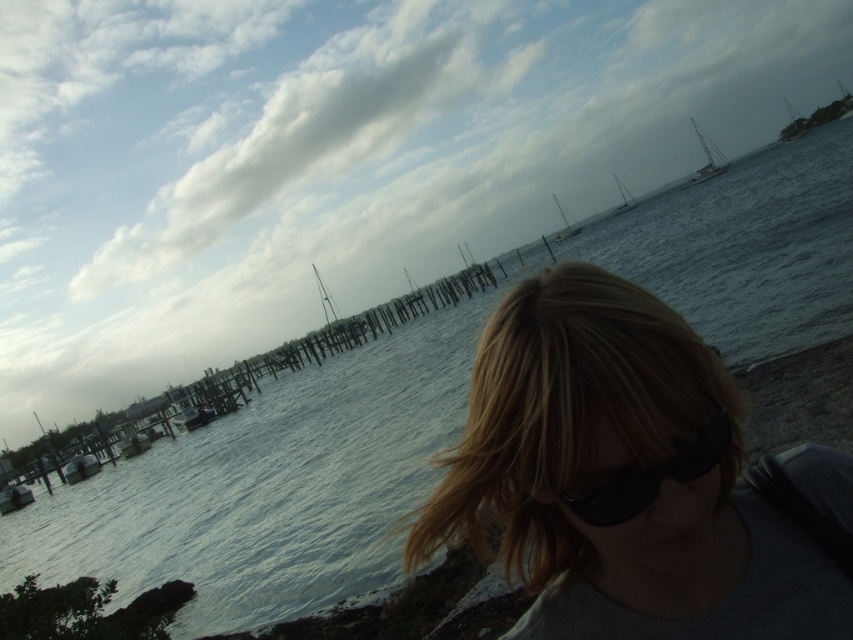
Does white sailboat at center appear over white matte sailboat at upper center?

Yes, white sailboat at center is above white matte sailboat at upper center.

Who is more forward, (625, 202) or (567, 234)?

Positioned in front is point (567, 234).

Does point (624, 188) come farther from viewer compared to point (556, 232)?

Yes, point (624, 188) is behind point (556, 232).

Find the location of a particular element. The image size is (853, 640). white sailboat at center is located at coordinates (624, 198).

Does point (722, 428) come farther from viewer compared to point (561, 232)?

No, it is in front of (561, 232).

Based on the photo, is black matte sunglasses at center above white matte sailboat at upper center?

Incorrect, black matte sunglasses at center is not positioned above white matte sailboat at upper center.

Which is in front, point (717, 461) or point (578, 228)?

Point (717, 461)

Find the location of a particular element. This screenshot has height=640, width=853. black matte sunglasses at center is located at coordinates (650, 476).

Is the position of white sailboat at upper right less distant than that of white sailboat at center?

Yes, it is in front of white sailboat at center.

Who is more forward, (715, 170) or (624, 196)?

Positioned in front is point (715, 170).

Does point (698, 179) lie behind point (621, 189)?

No, (698, 179) is closer to viewer.

You are a GUI agent. You are given a task and a screenshot of the screen. Output one action in this format:
    pyautogui.click(x=<x>, y=<y>)
    Task: Click on the white sailboat at upper right
    
    Given the screenshot: What is the action you would take?
    pyautogui.click(x=708, y=157)